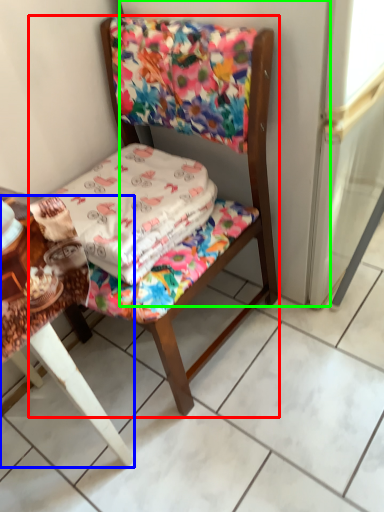
Question: Which object is positioned farthest from chair (highlighted by a red box)? Select from table (highlighted by a blue box) and screen door (highlighted by a green box).

Choices:
 (A) table
 (B) screen door

Answer: (A)